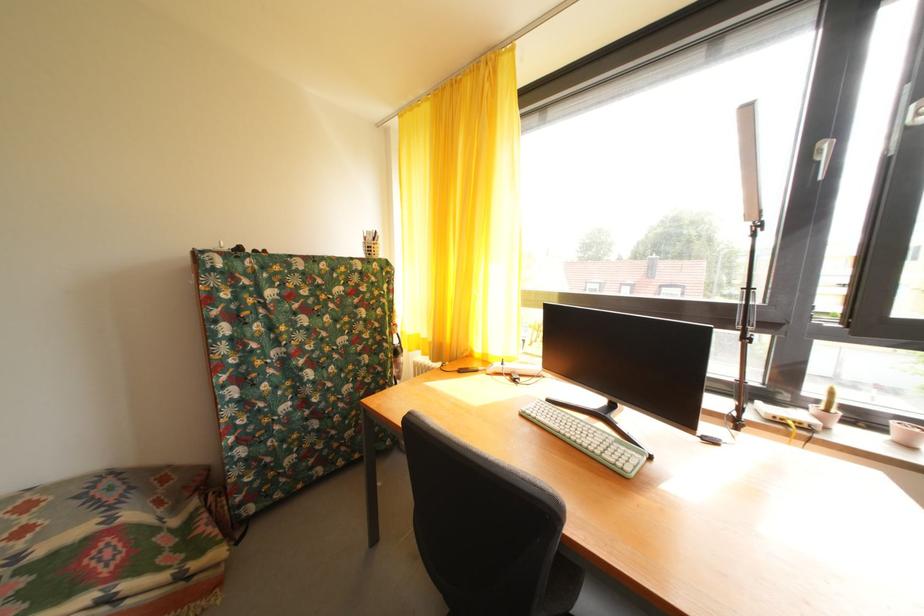
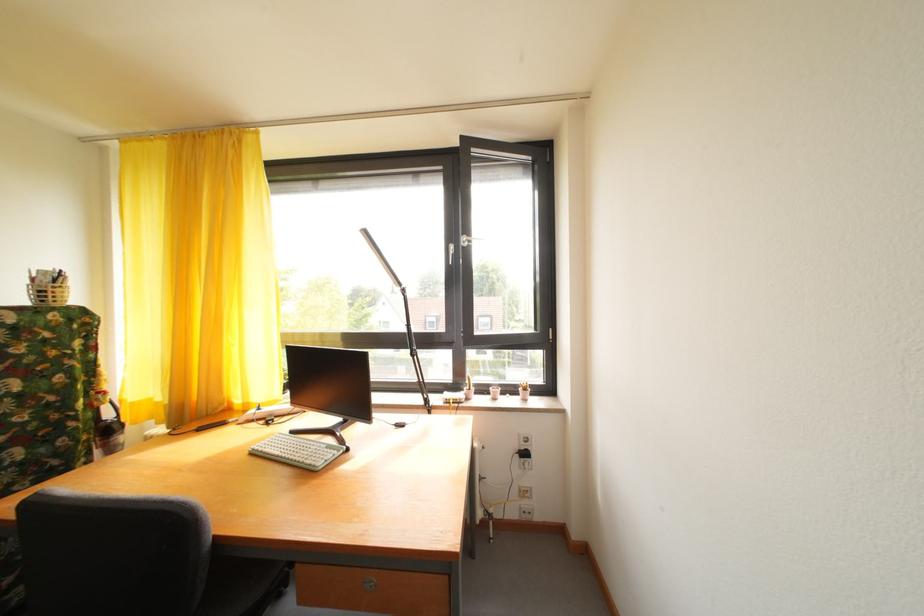
The point at (557, 407) is marked in the first image. Where is the corresponding point in the second image?

(301, 438)